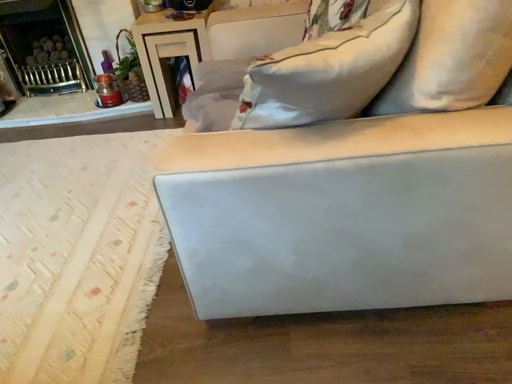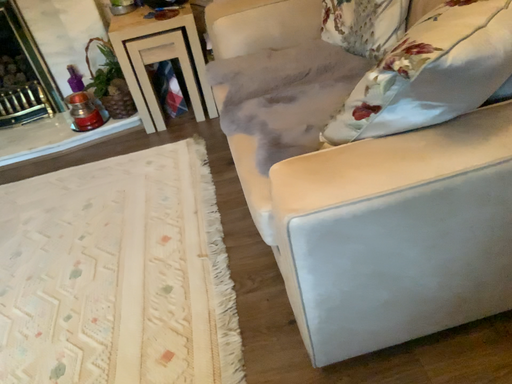
Question: How did the camera likely rotate when shooting the video?

Choices:
 (A) rotated left
 (B) rotated right

Answer: (B)